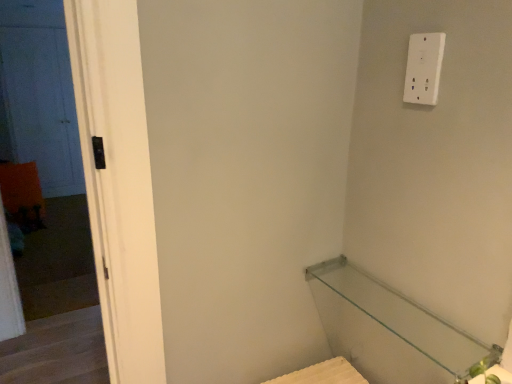
Question: From a real-world perspective, is white matte door at left above or below transparent glass shelf at lower right?

Choices:
 (A) above
 (B) below

Answer: (B)

Question: From the image's perspective, is white matte door at left above or below transparent glass shelf at lower right?

Choices:
 (A) above
 (B) below

Answer: (A)

Question: Based on their relative distances, which object is nearer to the transparent glass shelf at lower right?

Choices:
 (A) white matte door at left
 (B) white plastic light switch at upper right
 (C) black matte door at left

Answer: (B)

Question: Which object is positioned closest to the white plastic light switch at upper right?

Choices:
 (A) white matte door at left
 (B) black matte door at left
 (C) transparent glass shelf at lower right

Answer: (C)